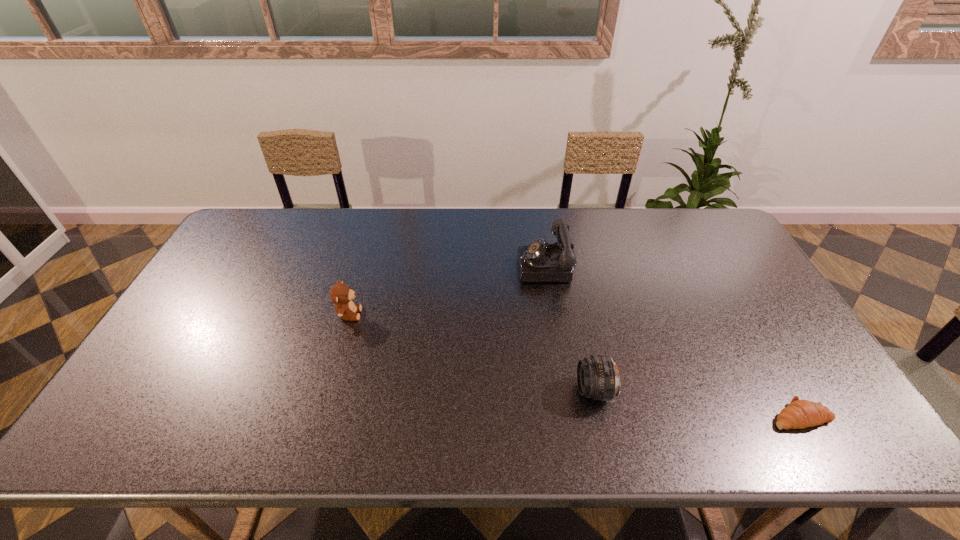
Find the location of a particular element. This screenshot has width=960, height=540. telephone is located at coordinates (540, 261).

Locate an element on the screen. This screenshot has height=540, width=960. the tallest object is located at coordinates (540, 261).

At what (x,y) coordinates should I click in order to perform the action: click on the leftmost object. Please return your answer as a coordinate pair (x, y). Looking at the image, I should click on (340, 294).

You are a GUI agent. You are given a task and a screenshot of the screen. Output one action in this format:
    pyautogui.click(x=<x>, y=<y>)
    Task: Click on the teddy bear
    
    Given the screenshot: What is the action you would take?
    pyautogui.click(x=340, y=294)

Locate an element on the screen. telephoto lens is located at coordinates (598, 378).

Locate an element on the screen. The width and height of the screenshot is (960, 540). crescent roll is located at coordinates pyautogui.click(x=799, y=414).

Find the location of `the rightmost object`. the rightmost object is located at coordinates (799, 414).

At what (x,y) coordinates should I click in order to perform the action: click on vacant point located on the dial of the farthest object. Please return your answer as a coordinate pair (x, y). The image size is (960, 540). Looking at the image, I should click on (471, 266).

This screenshot has height=540, width=960. I want to click on free space located 0.320m on the dial of the farthest object, so click(418, 266).

Identify the location of free point located on the dial of the farthest object. Image resolution: width=960 pixels, height=540 pixels. (409, 266).